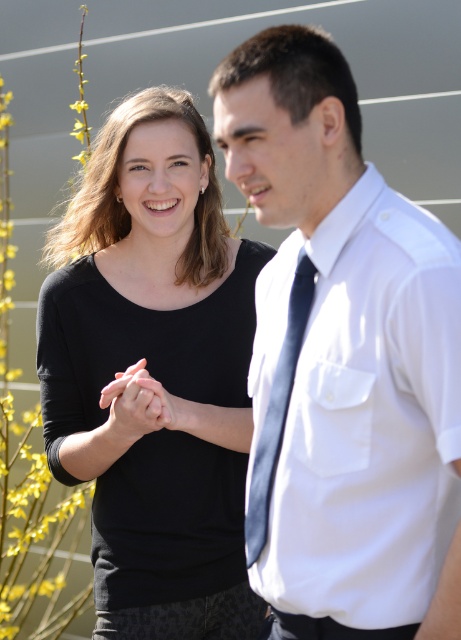
Question: Can you confirm if black matte shirt at center is positioned above white smooth shirt at right?

Choices:
 (A) yes
 (B) no

Answer: (A)

Question: Which point is farther to the camera?

Choices:
 (A) (282, 257)
 (B) (276, 417)

Answer: (A)

Question: Which of these objects is positioned closest to the matte black hands at center?

Choices:
 (A) dark blue silk tie at center
 (B) white smooth shirt at right

Answer: (A)

Question: Which of these objects is positioned farthest from the dark blue silk tie at center?

Choices:
 (A) white smooth shirt at right
 (B) black matte shirt at center

Answer: (B)

Question: Considering the relative positions of white smooth shirt at right and dark blue silk tie at center in the image provided, where is white smooth shirt at right located with respect to dark blue silk tie at center?

Choices:
 (A) below
 (B) above

Answer: (B)

Question: Does white smooth shirt at right appear on the right side of dark blue silk tie at center?

Choices:
 (A) yes
 (B) no

Answer: (A)